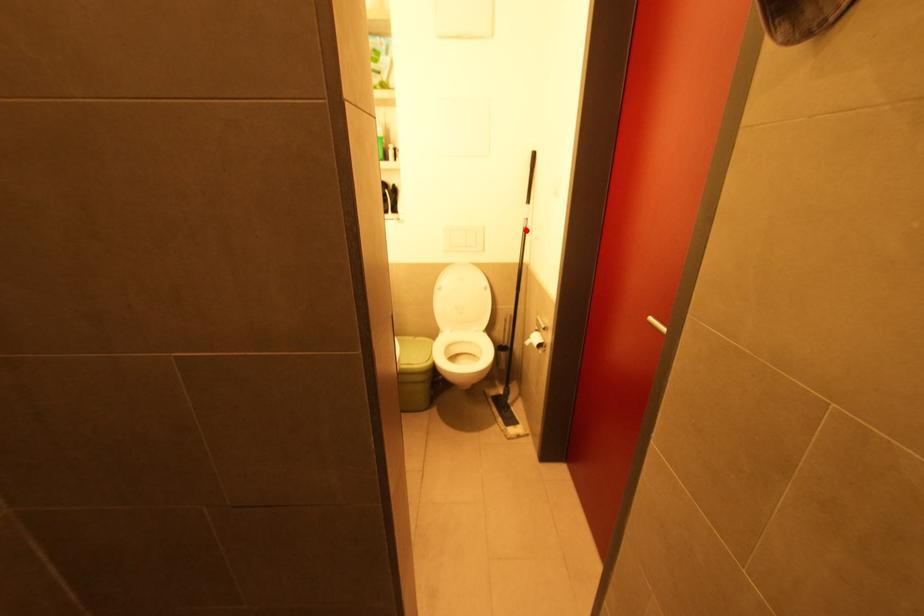
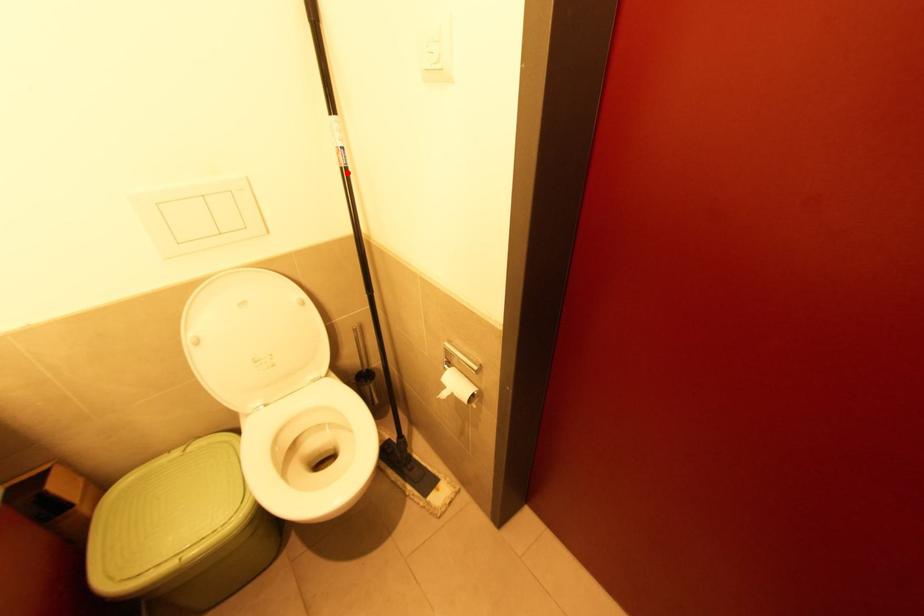
I am providing you with two images of the same scene from different viewpoints. A red point is marked on the first image and another point is marked on the second image. Do the highlighted points in image1 and image2 indicate the same real-world spot?

Yes